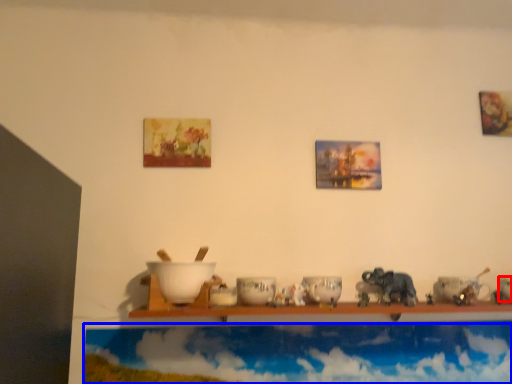
Question: Which point is further to the camera, tableware (highlighted by a red box) or cloud (highlighted by a blue box)?

Choices:
 (A) tableware
 (B) cloud

Answer: (B)